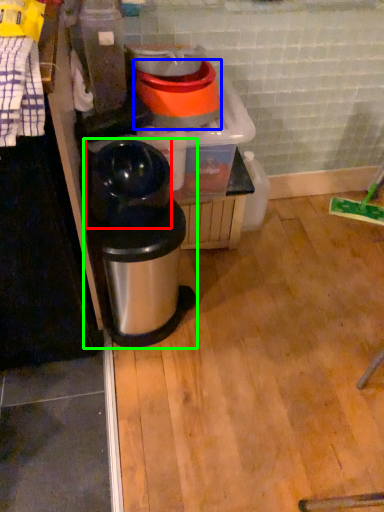
Question: Which is nearer to the appliance (highlighted by a red box)? appliance (highlighted by a blue box) or waste container (highlighted by a green box).

Choices:
 (A) appliance
 (B) waste container

Answer: (B)